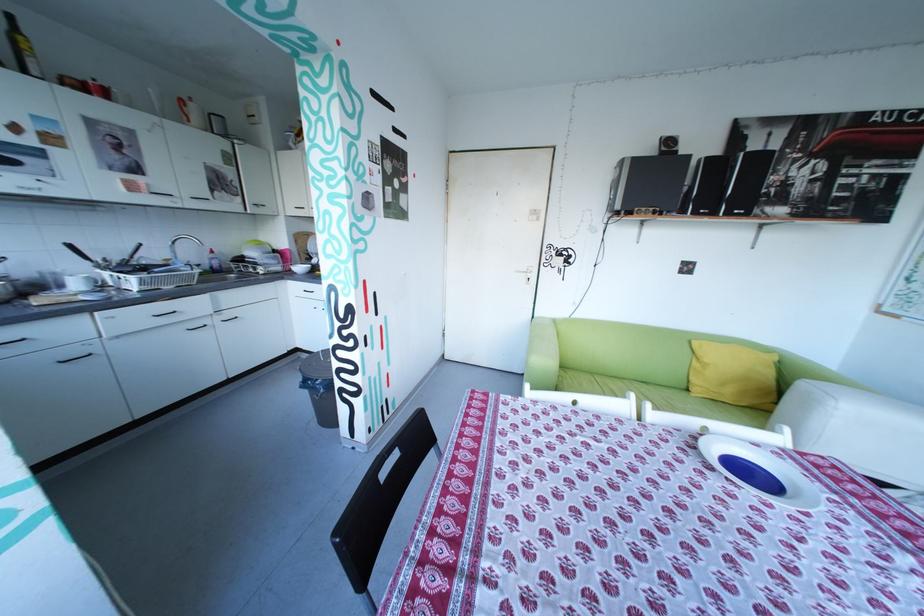
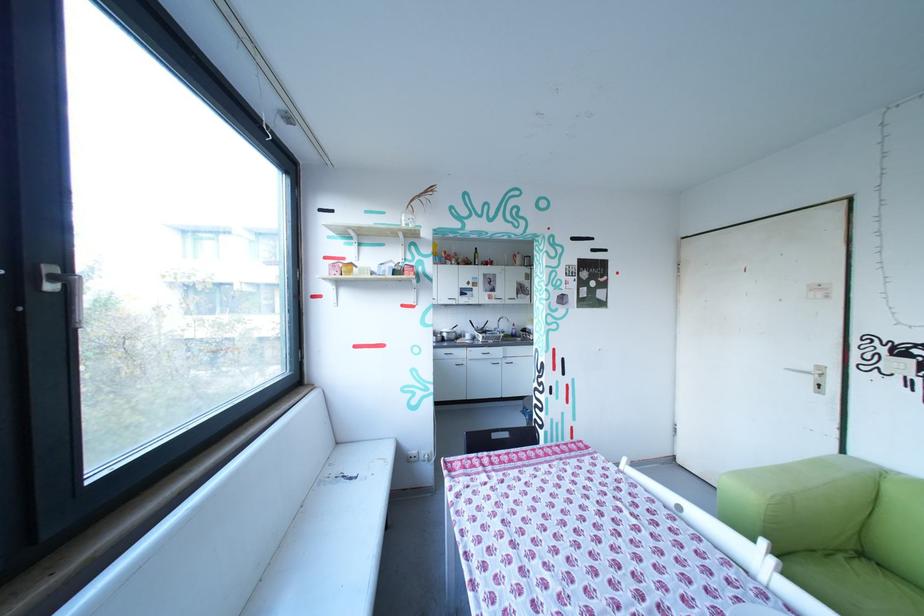
Question: The camera is either moving clockwise (left) or counter-clockwise (right) around the object. The first image is from the beginning of the video and the second image is from the end. Is the camera moving left or right when shooting the video?

Choices:
 (A) Left
 (B) Right

Answer: (B)